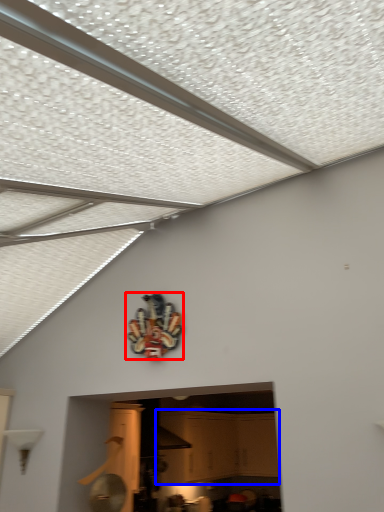
Question: Among these objects, which one is farthest to the camera, design (highlighted by a red box) or cabinetry (highlighted by a blue box)?

Choices:
 (A) design
 (B) cabinetry

Answer: (B)